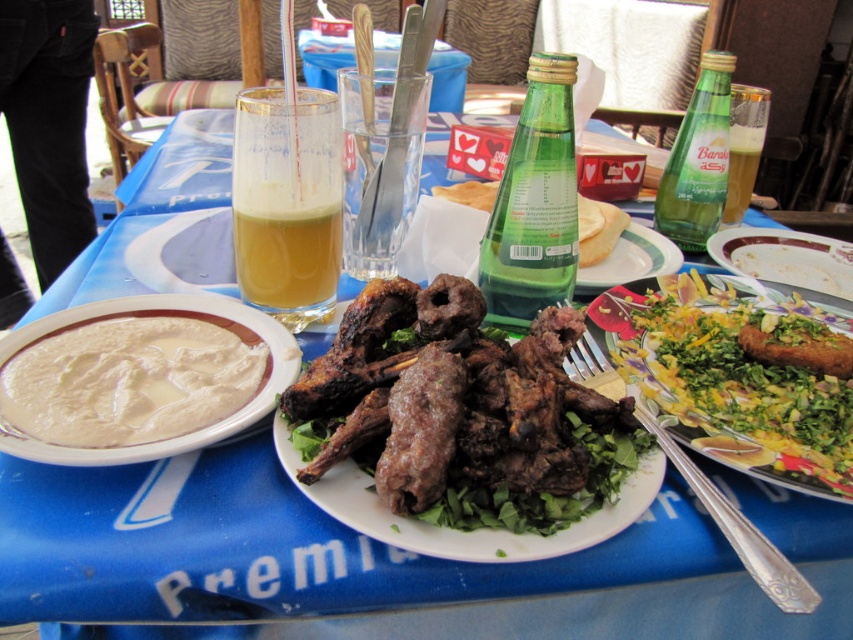
You are a customer at this outdoor dining spot and want to reach for the brown crispy meat at center. Based on the coordinates provided, where exactly should you reach to grab it?

The brown crispy meat at center is located at coordinates point (x=457, y=408), so you should reach towards that exact point to grab it.